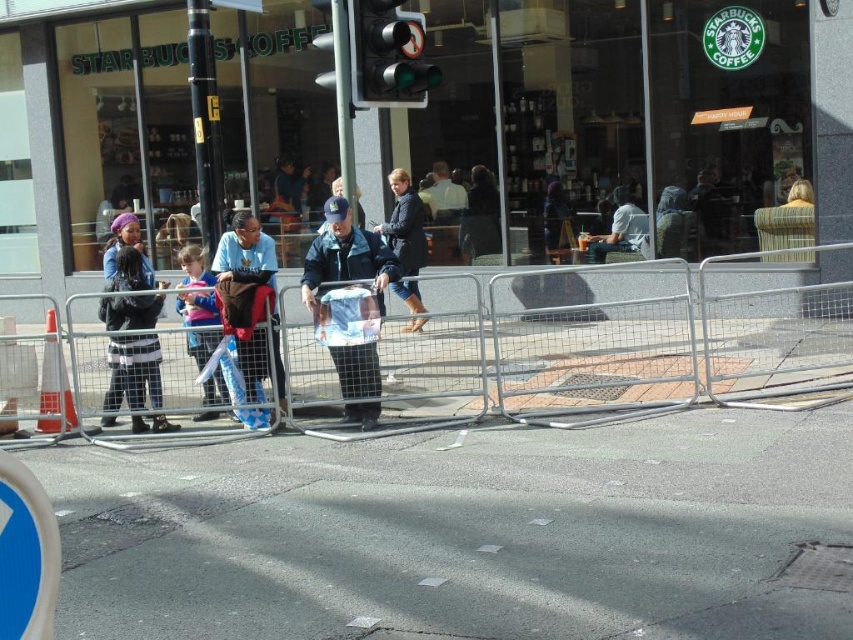
Who is positioned more to the left, gray asphalt pavement at center or green glass traffic light at center?

gray asphalt pavement at center

Which is behind, point (531, 573) or point (379, 65)?

The point (379, 65) is more distant.

Where is `gray asphalt pavement at center`? Image resolution: width=853 pixels, height=640 pixels. gray asphalt pavement at center is located at coordinates (460, 532).

Does dark blue jacket at center have a larger size compared to matte gray jacket at center?

No, dark blue jacket at center is not bigger than matte gray jacket at center.

Between dark blue jacket at center and matte gray jacket at center, which one has more height?

dark blue jacket at center

Locate an element on the screen. dark blue jacket at center is located at coordinates (x=480, y=216).

Image resolution: width=853 pixels, height=640 pixels. Identify the location of dark blue jacket at center. (480, 216).

Is point (393, 193) farther from camera compared to point (633, 209)?

That is True.

Is dark blue leather jacket at center taller than matte gray jacket at center?

Correct, dark blue leather jacket at center is much taller as matte gray jacket at center.

Does point (413, 298) lie behind point (630, 216)?

No, it is not.

Where is `dark blue leather jacket at center`? dark blue leather jacket at center is located at coordinates (405, 225).